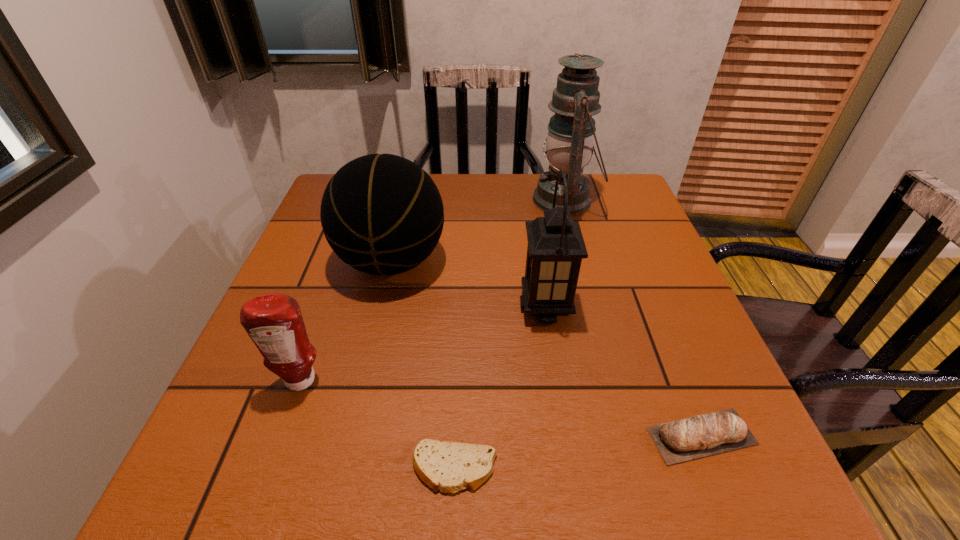
Where is `free space located on the front of the tallest object`? free space located on the front of the tallest object is located at coordinates (576, 242).

This screenshot has height=540, width=960. I want to click on free region located on the back of the lantern, so click(x=536, y=245).

Where is `vacant region located 0.080m on the left of the basketball`? vacant region located 0.080m on the left of the basketball is located at coordinates (302, 261).

The height and width of the screenshot is (540, 960). What are the coordinates of `free space located on the back of the third nearest object` in the screenshot? It's located at (349, 244).

Identify the location of free space located 0.310m on the back of the right pita bread. Image resolution: width=960 pixels, height=540 pixels. (641, 284).

In order to click on vacant space situated 0.270m on the back of the shorter pita bread in this screenshot , I will do `click(462, 318)`.

Locate an element on the screen. object present at the far edge is located at coordinates (571, 131).

You are a GUI agent. You are given a task and a screenshot of the screen. Output one action in this format:
    pyautogui.click(x=<x>, y=<y>)
    Task: Click on the basketball that is at the left edge
    The height and width of the screenshot is (540, 960).
    Given the screenshot: What is the action you would take?
    pyautogui.click(x=382, y=214)

This screenshot has width=960, height=540. I want to click on condiment that is at the left edge, so click(274, 322).

Where is `oil lamp located in the right edge section of the desktop`? oil lamp located in the right edge section of the desktop is located at coordinates (571, 131).